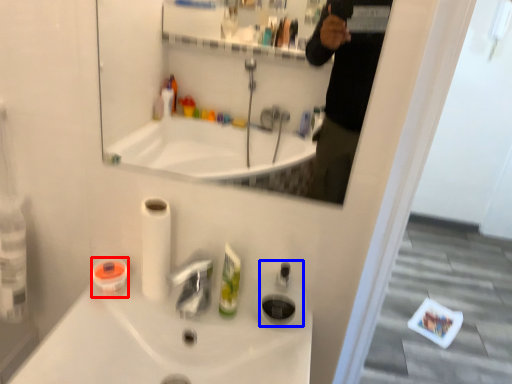
Question: Among these objects, which one is nearest to the camera, mouthwash (highlighted by a red box) or soap dispenser (highlighted by a blue box)?

Choices:
 (A) mouthwash
 (B) soap dispenser

Answer: (B)